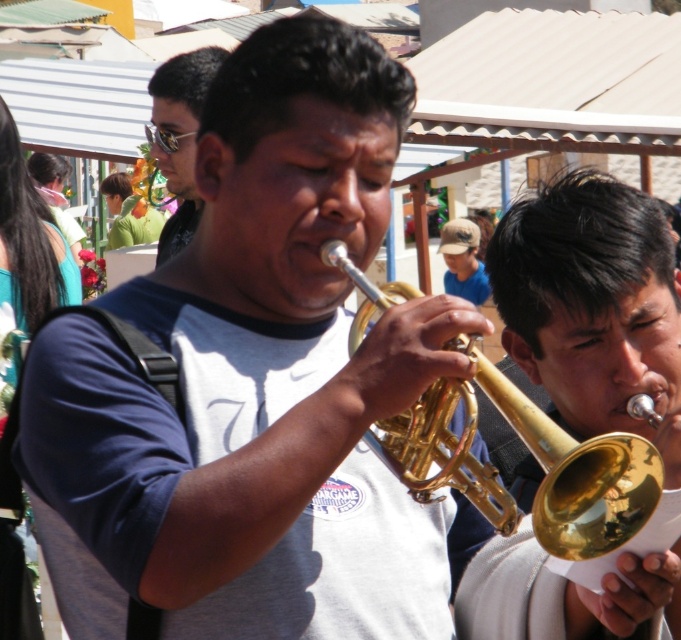
Is gold shiny trumpet at right bigger than matte black sunglasses at upper left?

No.

Can you confirm if gold shiny trumpet at right is positioned above matte black sunglasses at upper left?

Actually, gold shiny trumpet at right is below matte black sunglasses at upper left.

Identify the location of gold shiny trumpet at right. This screenshot has height=640, width=681. (592, 307).

Where is `gold shiny trumpet at right`? Image resolution: width=681 pixels, height=640 pixels. gold shiny trumpet at right is located at coordinates (592, 307).

Who is taller, gold shiny trumpet at right or gold brass trombone at center?

With more height is gold shiny trumpet at right.

From the picture: Can you confirm if gold shiny trumpet at right is positioned to the left of gold brass trombone at center?

Incorrect, gold shiny trumpet at right is not on the left side of gold brass trombone at center.

Locate an element on the screen. gold shiny trumpet at right is located at coordinates (592, 307).

Is gold brass trombone at center shorter than matte black sunglasses at upper left?

Yes, gold brass trombone at center is shorter than matte black sunglasses at upper left.

Which is more to the left, gold brass trombone at center or matte black sunglasses at upper left?

Positioned to the left is matte black sunglasses at upper left.

This screenshot has height=640, width=681. What are the coordinates of `gold brass trombone at center` in the screenshot? It's located at (575, 474).